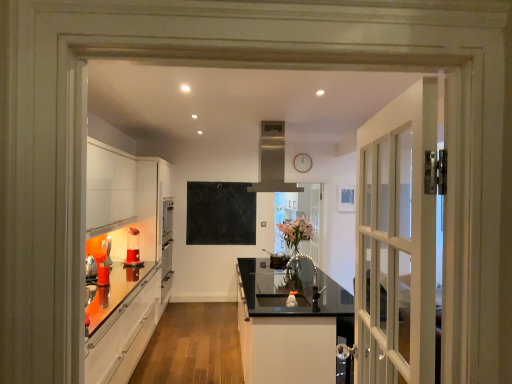
Question: Is clear glass door at center bigger or smaller than black matte chalkboard at center?

Choices:
 (A) big
 (B) small

Answer: (A)

Question: Which is correct: clear glass door at center is inside black matte chalkboard at center, or outside of it?

Choices:
 (A) inside
 (B) outside

Answer: (B)

Question: Considering the real-world distances, which object is farthest from the metallic silver faucet at center, positioned as the 3th appliance in back-to-front order?

Choices:
 (A) translucent plastic blender at lower left, the second appliance viewed from the right
 (B) black matte chalkboard at center
 (C) glossy black countertop at center
 (D) clear glass door at center
 (E) satin silver exhaust hood at upper center

Answer: (A)

Question: Which object is positioned farthest from the glossy black countertop at center?

Choices:
 (A) satin silver exhaust hood at upper center
 (B) metallic silver faucet at center, acting as the third appliance starting from the left
 (C) brushed metal kettle at left, which is counted as the 2th appliance, starting from the front
 (D) translucent plastic blender at lower left, acting as the 1th appliance starting from the back
 (E) black matte chalkboard at center

Answer: (C)